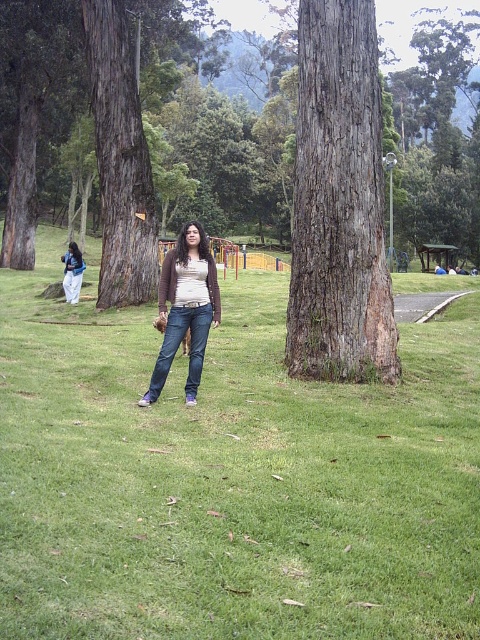
Who is shorter, green grassy at center or brown rough bark tree at left?

With less height is green grassy at center.

Between green grassy at center and brown rough bark tree at left, which one appears on the right side from the viewer's perspective?

Positioned to the right is green grassy at center.

Describe the element at coordinates (230, 477) in the screenshot. I see `green grassy at center` at that location.

Identify the location of green grassy at center. [x=230, y=477].

Can you confirm if green grassy at center is taller than denim jeans at center?

In fact, green grassy at center may be shorter than denim jeans at center.

Does point (396, 300) come in front of point (184, 324)?

That is False.

Is point (216, 416) more distant than point (149, 392)?

No.

The height and width of the screenshot is (640, 480). What are the coordinates of `green grassy at center` in the screenshot? It's located at (230, 477).

Can you confirm if brown rough bark tree at left is shorter than matte white pants at lower left?

No, brown rough bark tree at left is not shorter than matte white pants at lower left.

Is brown rough bark tree at left in front of matte white pants at lower left?

That is True.

Between point (156, 289) and point (76, 257), which one is positioned in front?

Point (156, 289) is more forward.

This screenshot has height=640, width=480. In order to click on brown rough bark tree at left in this screenshot , I will do `click(120, 161)`.